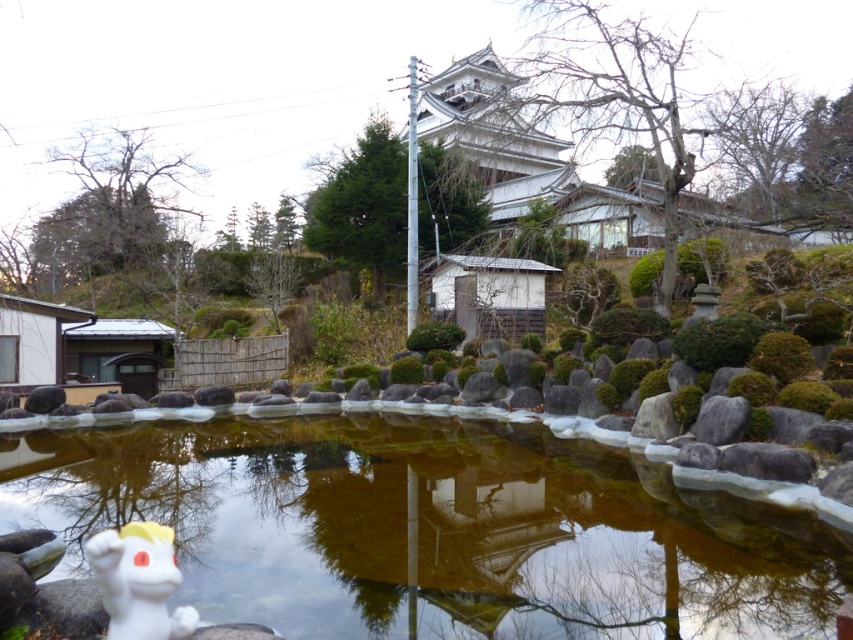
Is clear glass water at center bigger than white matte dragon at lower left?

Correct, clear glass water at center is larger in size than white matte dragon at lower left.

At what (x,y) coordinates should I click in order to perform the action: click on clear glass water at center. Please return your answer as a coordinate pair (x, y). This screenshot has height=640, width=853. Looking at the image, I should click on pyautogui.click(x=430, y=529).

I want to click on clear glass water at center, so click(430, 529).